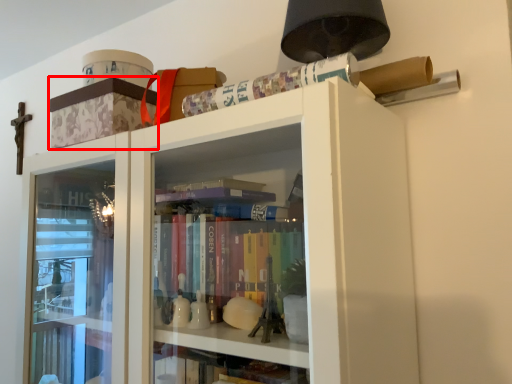
Question: From the image's perspective, what is the correct spatial positioning of cabinetry (annotated by the red box) in reference to paperback book?

Choices:
 (A) above
 (B) below

Answer: (A)